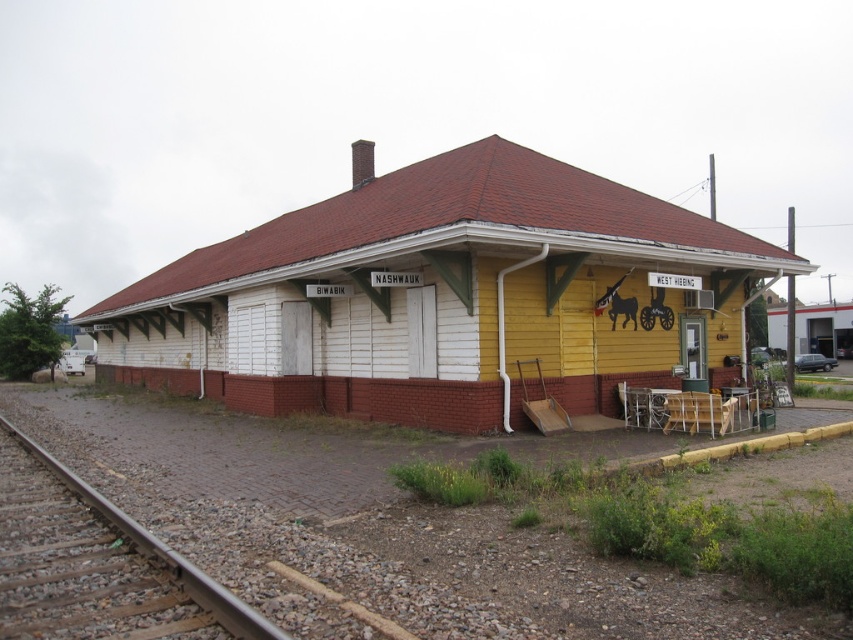
Question: In this image, where is yellow wood railway station at center located relative to brown wooden train track at lower left?

Choices:
 (A) below
 (B) above

Answer: (B)

Question: Is yellow wood railway station at center positioned at the back of brown wooden train track at lower left?

Choices:
 (A) no
 (B) yes

Answer: (B)

Question: Is yellow wood railway station at center thinner than brown wooden train track at lower left?

Choices:
 (A) no
 (B) yes

Answer: (A)

Question: Among these points, which one is nearest to the camera?

Choices:
 (A) (244, 620)
 (B) (397, 326)

Answer: (A)